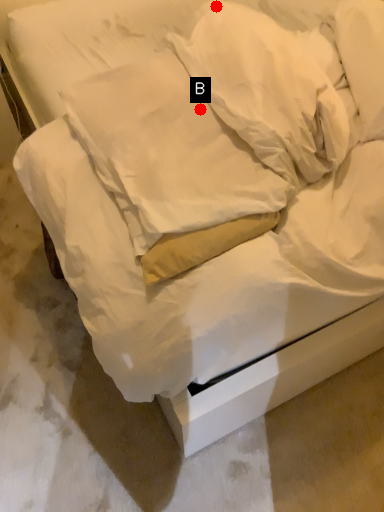
Question: Two points are circled on the image, labeled by A and B beside each circle. Which point is further to the camera?

Choices:
 (A) A is further
 (B) B is further

Answer: (A)